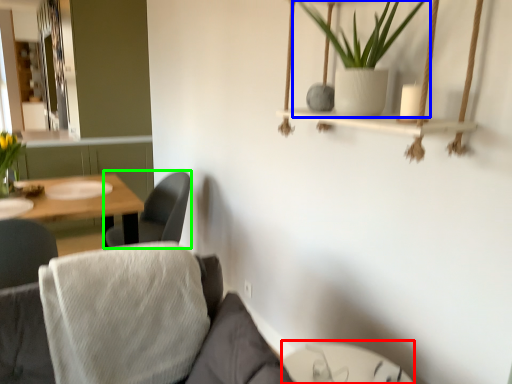
Question: Which object is the farthest from glass table (highlighted by a red box)? Choose among these: houseplant (highlighted by a blue box) or chair (highlighted by a green box).

Choices:
 (A) houseplant
 (B) chair

Answer: (B)